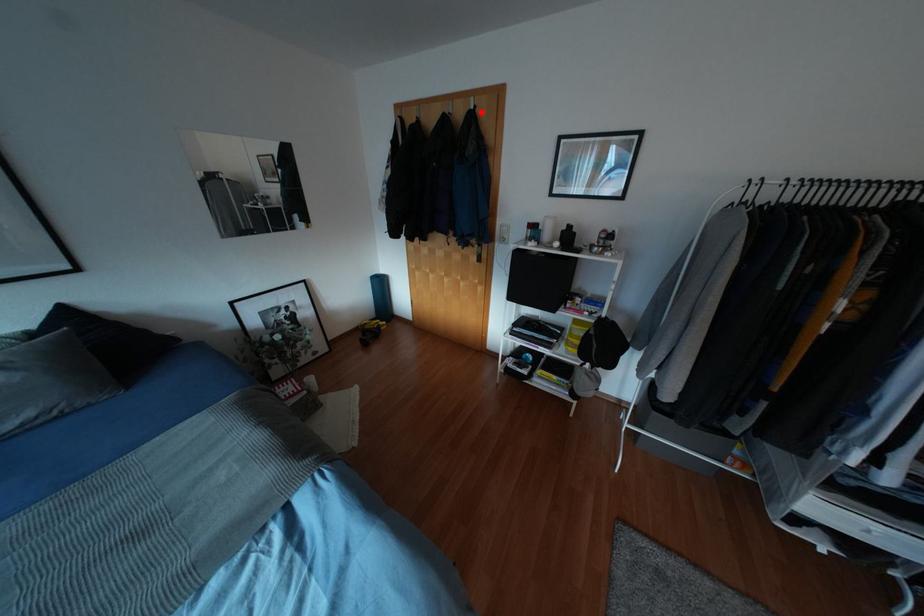
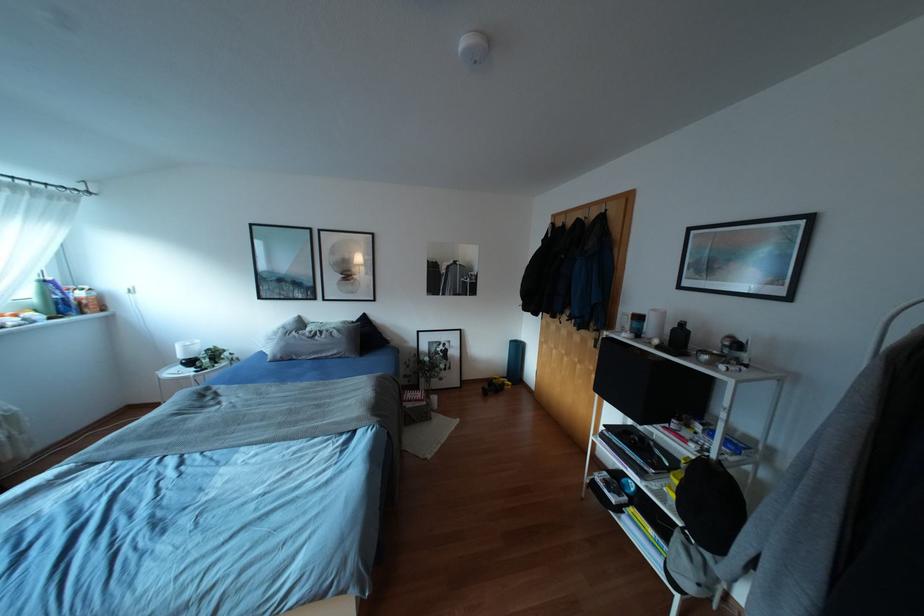
In the second image, find the point that corresponds to the highlighted location in the first image.

(612, 214)